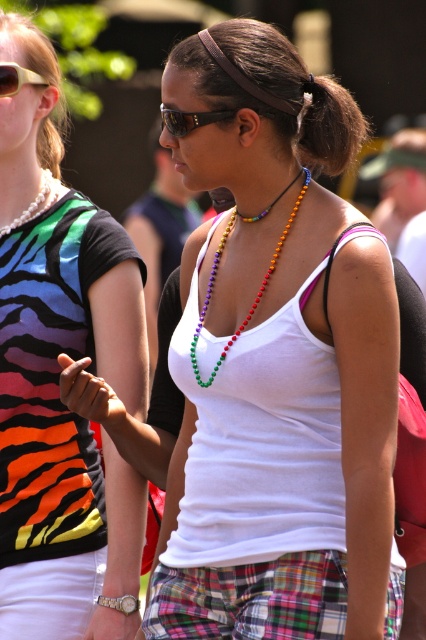
You are a photographer standing at the center of the scene. You want to take a closeup shot of both the matte black sunglasses at upper left and the pearl necklace at upper left. Can you fit both into your camera frame if your camera has a maximum field of view of 20 inches?

The matte black sunglasses at upper left is 20.61 inches away from the pearl necklace at upper left. Since the distance between them exceeds the camera frame of 20 inches, you cannot fit both into the frame.

Based on the scene description, which necklace is positioned lower between the multicolored beads necklace at center and the pearl necklace at upper left?

The multicolored beads necklace at center is positioned lower than the pearl necklace at upper left.